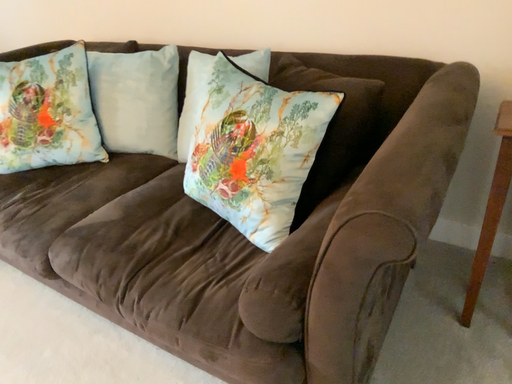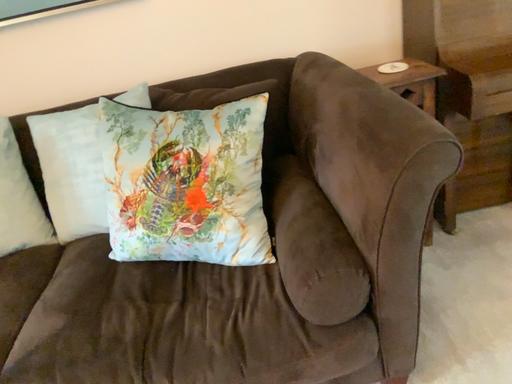
Question: How did the camera likely rotate when shooting the video?

Choices:
 (A) rotated right
 (B) rotated left

Answer: (A)